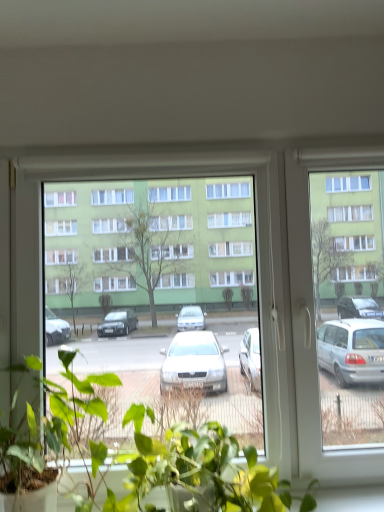
Question: Considering the relative sizes of green leafy plant at lower center, the second houseplant viewed from the left, and transparent glass window at center in the image provided, is green leafy plant at lower center, the second houseplant viewed from the left, wider than transparent glass window at center?

Choices:
 (A) yes
 (B) no

Answer: (A)

Question: Is the position of green leafy plant at lower center, the second houseplant viewed from the left, more distant than that of transparent glass window at center?

Choices:
 (A) yes
 (B) no

Answer: (B)

Question: Considering the relative sizes of green leafy plant at lower center, which is the first houseplant in right-to-left order, and transparent glass window at center in the image provided, is green leafy plant at lower center, which is the first houseplant in right-to-left order, smaller than transparent glass window at center?

Choices:
 (A) yes
 (B) no

Answer: (A)

Question: Is green leafy plant at lower center, which is the first houseplant in right-to-left order, to the right of transparent glass window at center from the viewer's perspective?

Choices:
 (A) no
 (B) yes

Answer: (A)

Question: Are green leafy plant at lower center, which is the first houseplant in right-to-left order, and transparent glass window at center making contact?

Choices:
 (A) no
 (B) yes

Answer: (A)

Question: From a real-world perspective, is green leafy plant at lower center, which is the first houseplant in right-to-left order, physically located above or below green matte plant at center, which appears as the first houseplant when viewed from the left?

Choices:
 (A) below
 (B) above

Answer: (A)

Question: Is green leafy plant at lower center, the second houseplant viewed from the left, in front of or behind green matte plant at center, which appears as the first houseplant when viewed from the left, in the image?

Choices:
 (A) front
 (B) behind

Answer: (B)

Question: Looking at their shapes, would you say green leafy plant at lower center, the second houseplant viewed from the left, is wider or thinner than green matte plant at center, acting as the second houseplant starting from the right?

Choices:
 (A) wide
 (B) thin

Answer: (B)

Question: Considering the relative positions of green leafy plant at lower center, the second houseplant viewed from the left, and green matte plant at center, which appears as the first houseplant when viewed from the left, in the image provided, is green leafy plant at lower center, the second houseplant viewed from the left, to the left or to the right of green matte plant at center, which appears as the first houseplant when viewed from the left,?

Choices:
 (A) left
 (B) right

Answer: (B)

Question: Would you say green matte plant at center, acting as the second houseplant starting from the right, is to the left or to the right of transparent glass window at center in the picture?

Choices:
 (A) left
 (B) right

Answer: (A)

Question: Is green matte plant at center, which appears as the first houseplant when viewed from the left, inside or outside of transparent glass window at center?

Choices:
 (A) inside
 (B) outside

Answer: (B)

Question: Considering their positions, is green matte plant at center, acting as the second houseplant starting from the right, located in front of or behind transparent glass window at center?

Choices:
 (A) behind
 (B) front

Answer: (B)

Question: Considering the positions of green matte plant at center, acting as the second houseplant starting from the right, and transparent glass window at center in the image, is green matte plant at center, acting as the second houseplant starting from the right, taller or shorter than transparent glass window at center?

Choices:
 (A) short
 (B) tall

Answer: (A)

Question: From a real-world perspective, is green matte plant at center, which appears as the first houseplant when viewed from the left, physically located above or below green leafy plant at lower center, the second houseplant viewed from the left?

Choices:
 (A) above
 (B) below

Answer: (A)

Question: In terms of width, does green matte plant at center, which appears as the first houseplant when viewed from the left, look wider or thinner when compared to green leafy plant at lower center, which is the first houseplant in right-to-left order?

Choices:
 (A) wide
 (B) thin

Answer: (A)